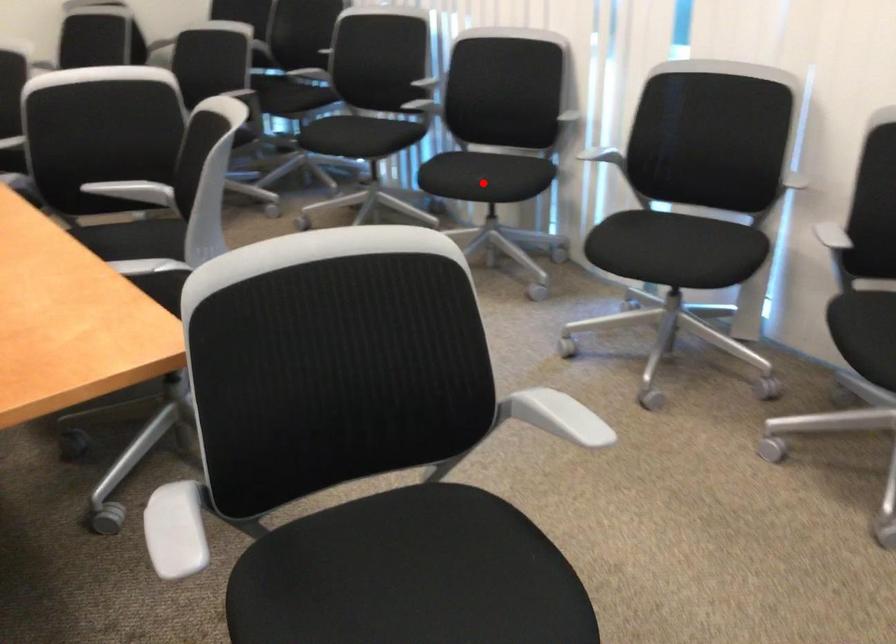
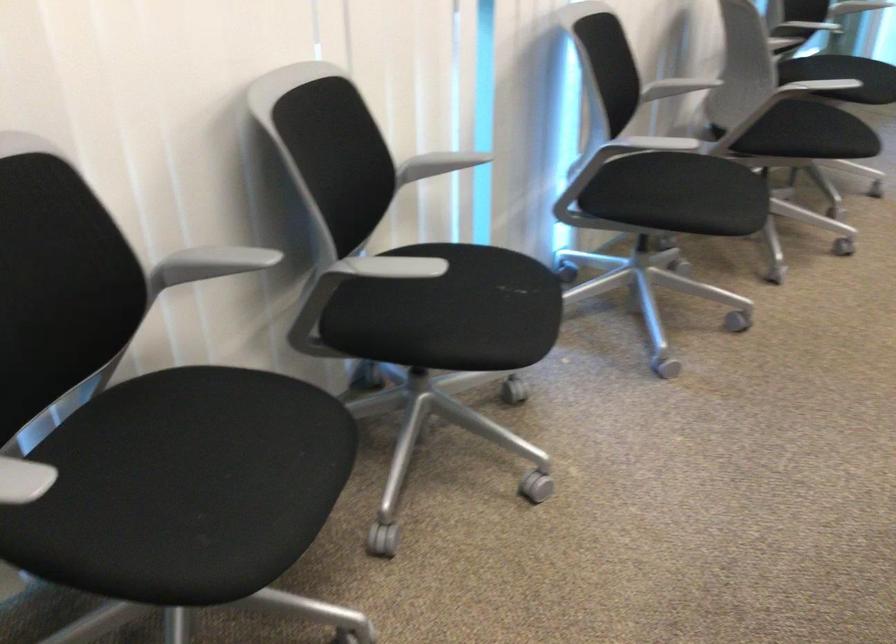
Locate, in the second image, the point that corresponds to the highlighted location in the first image.

(515, 287)